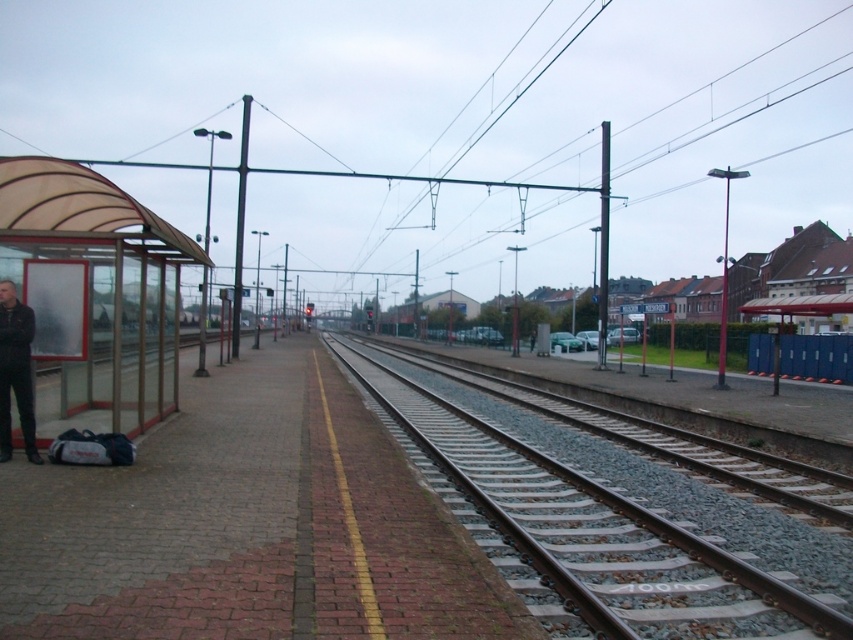
Question: Which object appears farthest from the camera in this image?

Choices:
 (A) smooth metal tracks at center
 (B) translucent plastic bus stop at left

Answer: (B)

Question: Is smooth metal tracks at center wider than translucent plastic bus stop at left?

Choices:
 (A) yes
 (B) no

Answer: (A)

Question: Is smooth metal tracks at center behind dark gray jacket at left?

Choices:
 (A) no
 (B) yes

Answer: (A)

Question: Which of the following is the closest to the observer?

Choices:
 (A) (761, 572)
 (B) (119, 257)

Answer: (A)

Question: Is smooth metal tracks at center to the left of translucent plastic bus stop at left from the viewer's perspective?

Choices:
 (A) no
 (B) yes

Answer: (A)

Question: Which point is farther from the camera taking this photo?

Choices:
 (A) (634, 634)
 (B) (44, 440)
 (C) (24, 424)

Answer: (B)